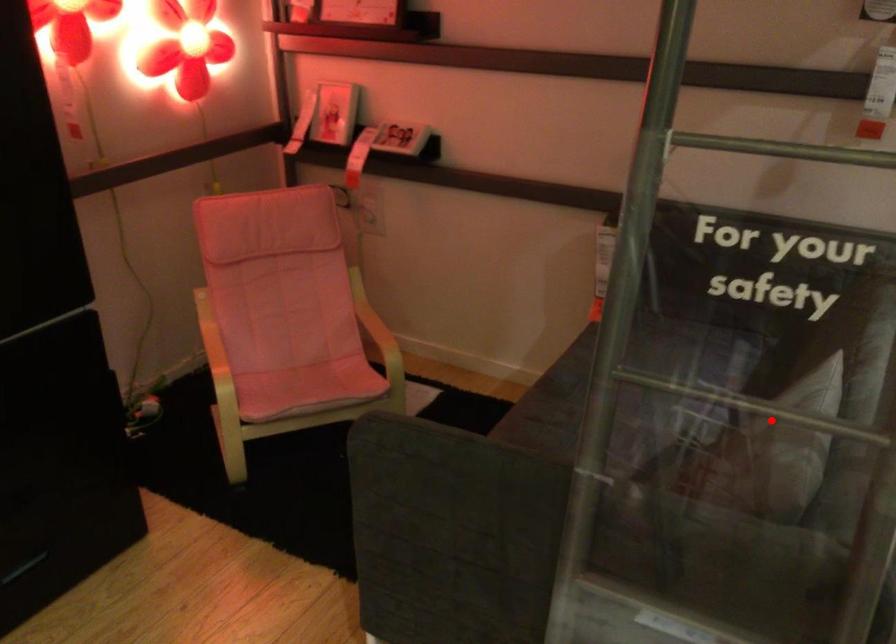
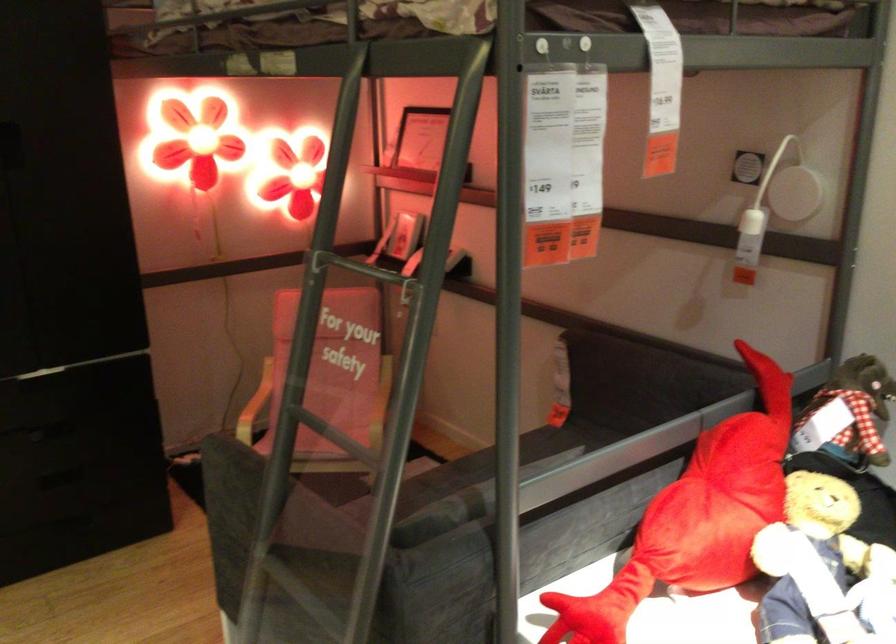
Question: A red point is marked in image1. In image2, is the corresponding 3D point closer to the camera or farther? Reply with the corresponding letter.

Choices:
 (A) The corresponding 3D point is closer.
 (B) The corresponding 3D point is farther.

Answer: (B)